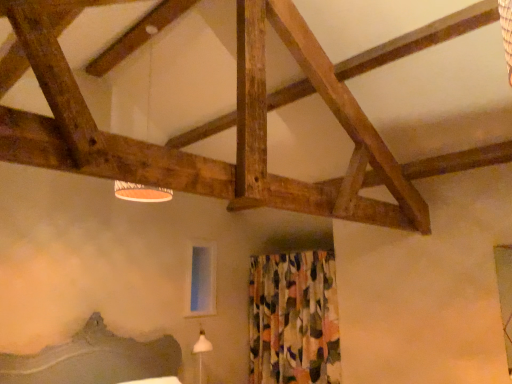
Question: From a real-world perspective, is floral fabric curtain at center physically below transparent glass window screen at center?

Choices:
 (A) yes
 (B) no

Answer: (A)

Question: Considering the relative sizes of floral fabric curtain at center and transparent glass window screen at center in the image provided, is floral fabric curtain at center smaller than transparent glass window screen at center?

Choices:
 (A) no
 (B) yes

Answer: (A)

Question: Is floral fabric curtain at center in front of transparent glass window screen at center?

Choices:
 (A) yes
 (B) no

Answer: (A)

Question: From a real-world perspective, is floral fabric curtain at center on top of transparent glass window screen at center?

Choices:
 (A) no
 (B) yes

Answer: (A)

Question: From the image's perspective, would you say floral fabric curtain at center is positioned over transparent glass window screen at center?

Choices:
 (A) yes
 (B) no

Answer: (B)

Question: Is floral fabric curtain at center at the right side of transparent glass window screen at center?

Choices:
 (A) no
 (B) yes

Answer: (B)

Question: Is floral fabric curtain at center bigger than white fabric lampshade at upper center?

Choices:
 (A) no
 (B) yes

Answer: (B)

Question: Is floral fabric curtain at center smaller than white fabric lampshade at upper center?

Choices:
 (A) yes
 (B) no

Answer: (B)

Question: Does floral fabric curtain at center lie in front of white fabric lampshade at upper center?

Choices:
 (A) no
 (B) yes

Answer: (A)

Question: Is floral fabric curtain at center further to the viewer compared to white fabric lampshade at upper center?

Choices:
 (A) yes
 (B) no

Answer: (A)

Question: From a real-world perspective, is floral fabric curtain at center under white fabric lampshade at upper center?

Choices:
 (A) no
 (B) yes

Answer: (B)

Question: From the image's perspective, is floral fabric curtain at center above white fabric lampshade at upper center?

Choices:
 (A) no
 (B) yes

Answer: (A)

Question: Does white fabric lampshade at upper center appear on the right side of transparent glass window screen at center?

Choices:
 (A) no
 (B) yes

Answer: (A)